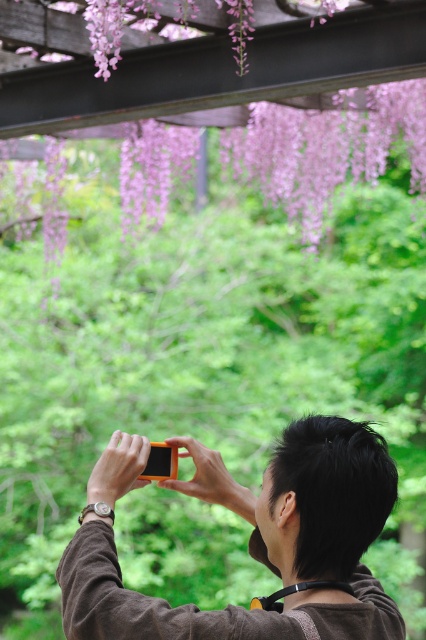
You are the photographer in the scene and want to capture the purple matte flowers at upper center in your photo. Is the orange matte camera at center positioned in a way that might block the view of the flowers?

The orange matte camera at center is in front of the purple matte flowers at upper center, so it will block the view of the flowers unless moved.

The person is holding an orange smartphone with both hands, aiming it towards the subject of their photo. Where is the orange smartphone located in relation to the point at coordinates (250, 540)?

The point at coordinates (250, 540) is on the orange matte camera at center, so the orange smartphone is located at that point.

You are a photographer trying to frame a shot of the purple wisteria flowers in the background. Your orange matte camera at center is currently positioned at coordinates 0.845, 0.587. To capture the flowers optimally, you need to adjust your camera to the point 0.5, 0.5. Is your current position sufficient, or do you need to move the camera left, right, up, or down?

The orange matte camera at center is currently at point (250, 540). To reach the desired point (213, 320), you need to move the camera to the left and slightly downward since the current x coordinate is higher than 0.5 and the y coordinate is also higher than 0.5.